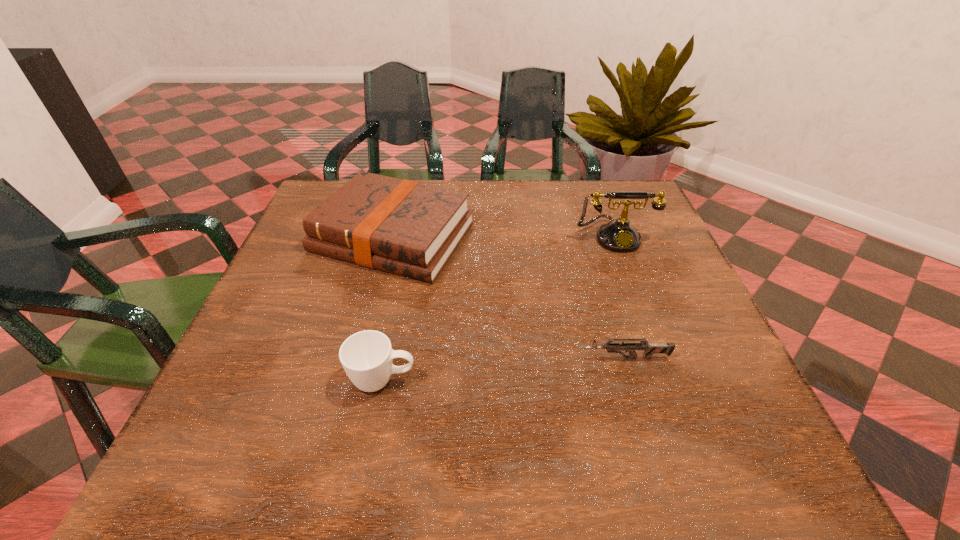
This screenshot has height=540, width=960. What are the coordinates of `vacant position located aimed along the barrel of the second nearest object` in the screenshot? It's located at (407, 358).

In order to click on telephone that is at the far edge in this screenshot , I will do `click(618, 235)`.

Image resolution: width=960 pixels, height=540 pixels. I want to click on hardback book at the far edge, so click(404, 227).

Locate an element on the screen. The width and height of the screenshot is (960, 540). object positioned at the left edge is located at coordinates (404, 227).

The image size is (960, 540). Identify the location of telephone present at the right edge. (618, 235).

Identify the location of gun positioned at the right edge. This screenshot has height=540, width=960. (649, 349).

Image resolution: width=960 pixels, height=540 pixels. What are the coordinates of `object situated at the far left corner` in the screenshot? It's located at (404, 227).

Locate an element on the screen. Image resolution: width=960 pixels, height=540 pixels. object situated at the far right corner is located at coordinates (618, 235).

The width and height of the screenshot is (960, 540). What are the coordinates of `free space at the far edge of the desktop` in the screenshot? It's located at (493, 197).

What are the coordinates of `vacant point at the near edge` in the screenshot? It's located at (331, 441).